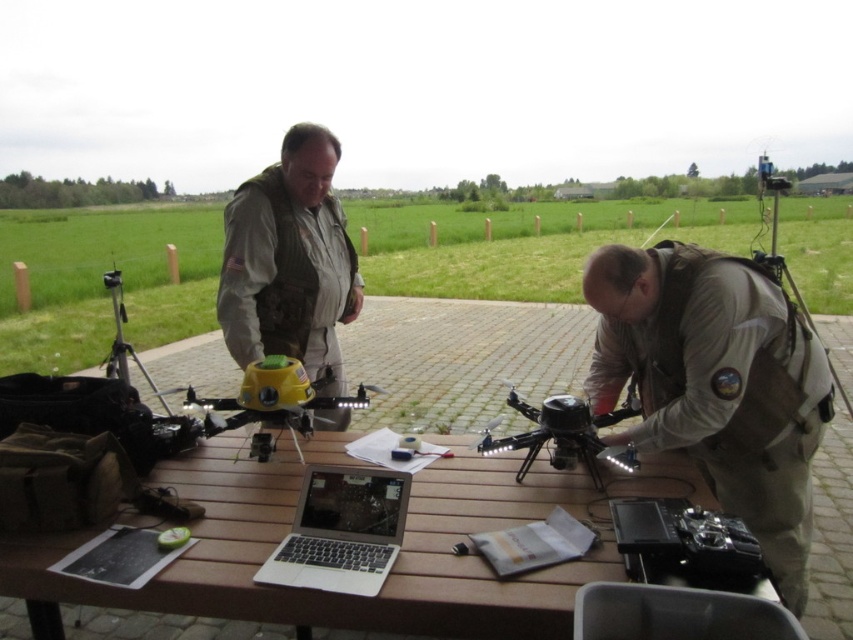
Is the position of camouflage fabric vest at center less distant than that of black matte drone at center?

No.

How far apart are camouflage fabric vest at center and black matte drone at center?

A distance of 36.66 inches exists between camouflage fabric vest at center and black matte drone at center.

Is point (285, 221) positioned after point (509, 449)?

Yes, it is behind point (509, 449).

Identify the location of camouflage fabric vest at center. (289, 260).

Between point (442, 561) and point (294, 547), which one is positioned in front?

Point (442, 561) is more forward.

Find the location of a particular element. The height and width of the screenshot is (640, 853). wooden table at center is located at coordinates (337, 593).

Does camouflage fabric vest at center have a greater height compared to black matte tripod at left?

Incorrect, camouflage fabric vest at center's height is not larger of black matte tripod at left's.

Is point (337, 211) closer to viewer compared to point (132, 352)?

Yes.

Between point (314, 144) and point (120, 342), which one is positioned in front?

Point (314, 144) is more forward.

Locate an element on the screen. The height and width of the screenshot is (640, 853). camouflage fabric vest at center is located at coordinates (289, 260).